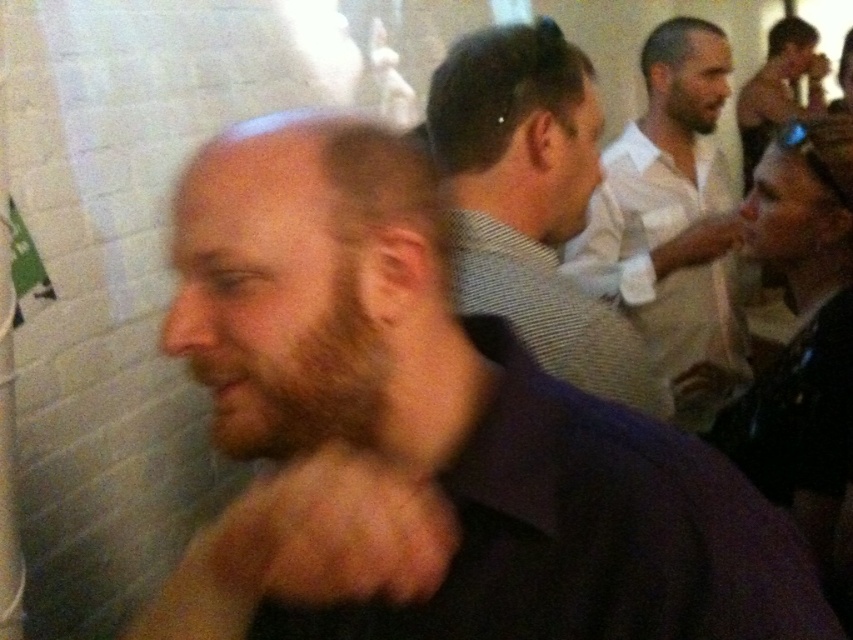
You are a photographer trying to capture a clear portrait of the man with the brown beard at center and the checkered shirt at center. The camera you are using has a focus range of 50 centimeters. Can you focus on both subjects simultaneously?

The brown beard at center and checkered shirt at center are 53.65 centimeters apart from each other. Since the camera has a focus range of 50 centimeters, it cannot focus on both subjects at the same time because the distance between them exceeds the focus range.

You are a photographer at the event and want to take a clear photo of both the brown beard at center and the white shirt at center. The minimum distance required between subjects for your camera to focus properly is 1.5 meters. Can you take a photo of both subjects without moving them?

The brown beard at center and the white shirt at center are 1.32 meters apart, which is less than the required 1.5 meters for proper focus. Therefore, you cannot take a photo of both subjects without moving them.